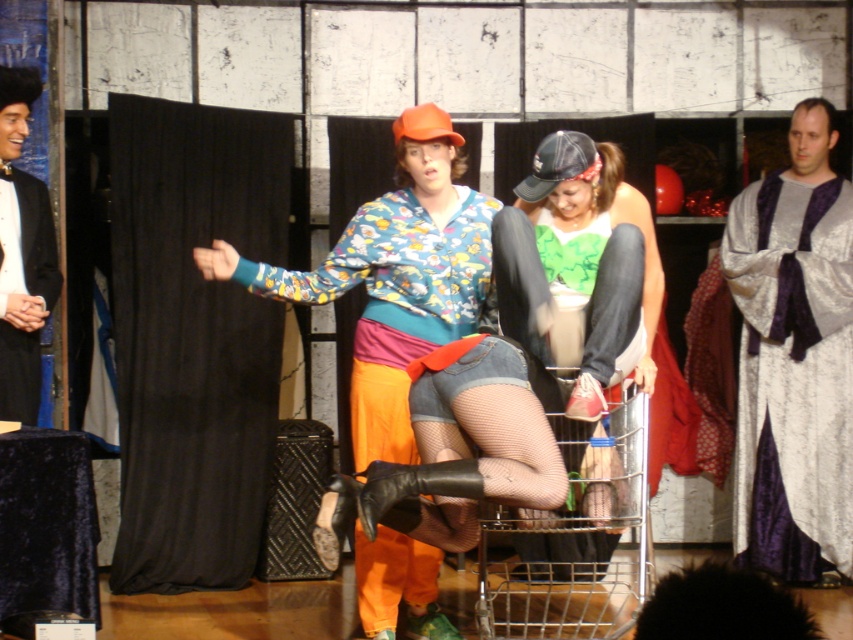
You are a stagehand preparing to adjust the lighting for the performance. You need to ensure that the silvery metallic robe at right and the green jersey at center are both illuminated. Considering their positions, which object should you focus the spotlight on first to ensure it reaches both effectively?

The silvery metallic robe at right has a greater height compared to the green jersey at center, so you should focus the spotlight on the silvery metallic robe at right first. This way, the light will naturally cover the shorter green jersey at center as well.

Based on the scene description, can you determine the spatial relationship between the green jersey at center and the metallic silver shopping cart at lower center?

The green jersey at center is above the metallic silver shopping cart at lower center.